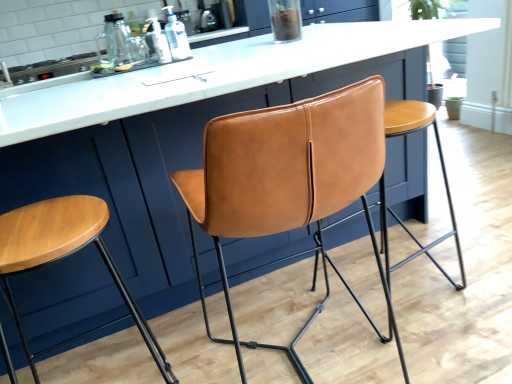
I want to click on vacant space underneath matte leather stool at center, the 2th stool in the left-to-right sequence (from a real-world perspective), so click(412, 301).